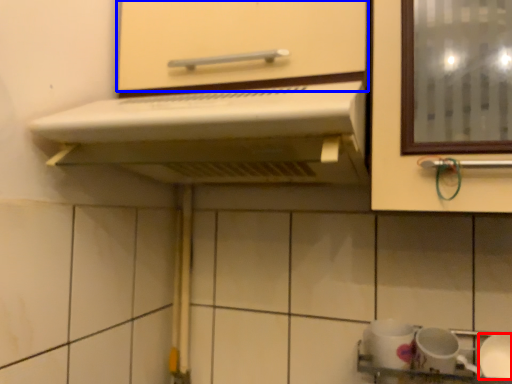
Question: Among these objects, which one is nearest to the camera, tableware (highlighted by a red box) or cabinetry (highlighted by a blue box)?

Choices:
 (A) tableware
 (B) cabinetry

Answer: (B)